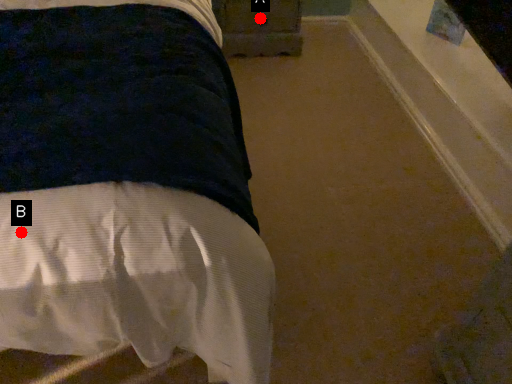
Question: Two points are circled on the image, labeled by A and B beside each circle. Which point is farther from the camera taking this photo?

Choices:
 (A) A is further
 (B) B is further

Answer: (A)